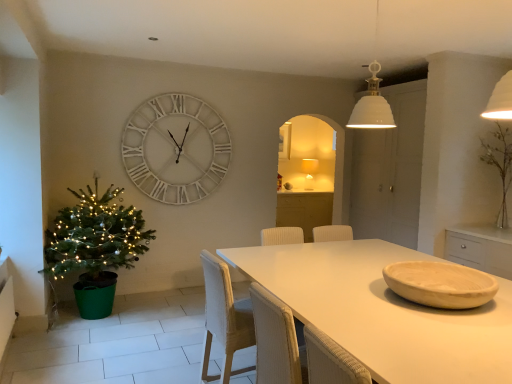
Where is `free space above white matte table at center (from a real-world perspective)`? The image size is (512, 384). free space above white matte table at center (from a real-world perspective) is located at coordinates (369, 291).